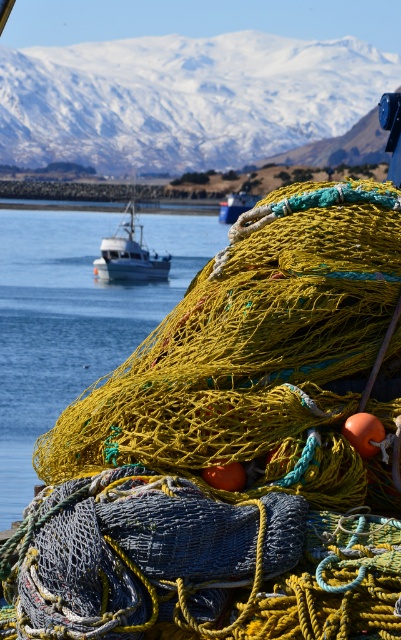
You are a photographer planning to take a photo of the snowy white mountain at upper center and transparent blue water at center. If your camera can focus on objects within 100 feet, will both objects be in focus?

The snowy white mountain at upper center is 100.36 feet away from the transparent blue water at center. Since the distance between them exceeds the camera focus range of 100 feet, both objects might not be in focus simultaneously.

You are standing at the edge of the water and want to cross to the other side. The boat is moving towards the left. If you want to board the boat before it reaches the transparent blue water at center, which direction should you run towards?

You should run towards the left because the boat is moving towards the left and the transparent blue water at center is located at point (74, 317), so the boat will reach there first if you move in that direction.